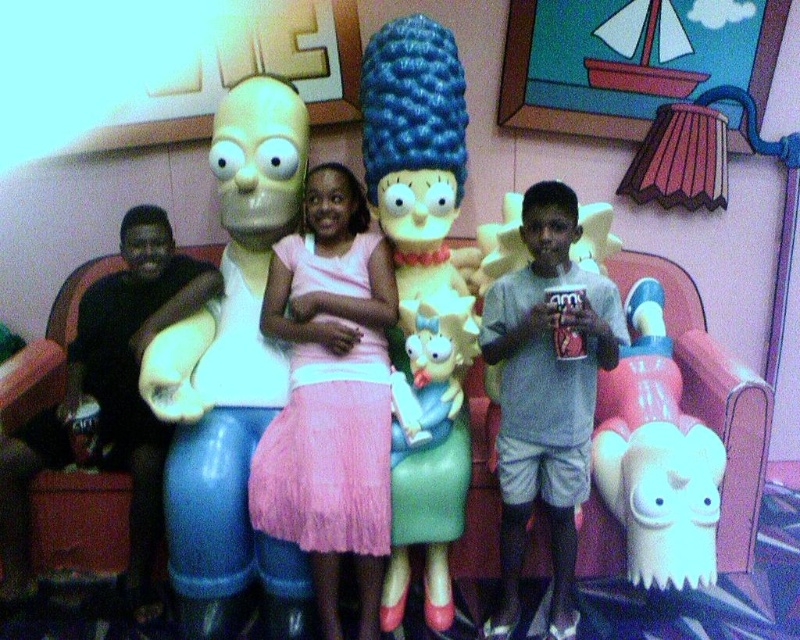
You are a photographer trying to capture a group photo of the gray cotton shirt at center and the white matte toy at lower right. Which object should you focus on first if you want to ensure both are in the frame without moving the camera?

The gray cotton shirt at center should be focused on first because its width is larger than the white matte toy at lower right, so ensuring it fits properly will automatically accommodate the smaller object within the frame.

In the scene shown: Based on the scene description, where is the gray cotton shirt at center located in terms of coordinates?

The gray cotton shirt at center is located at point coordinates of 0.616 on the x axis and 0.684 on the y axis.

You are a photographer trying to capture a photo of the smooth plastic homer simpson at left and the gray cotton shirt at center. Which one of these two objects should you focus on first if you want to ensure both are in focus, considering their sizes?

The smooth plastic homer simpson at left is bigger than the gray cotton shirt at center, so focusing on the larger object first would help ensure both are in focus.